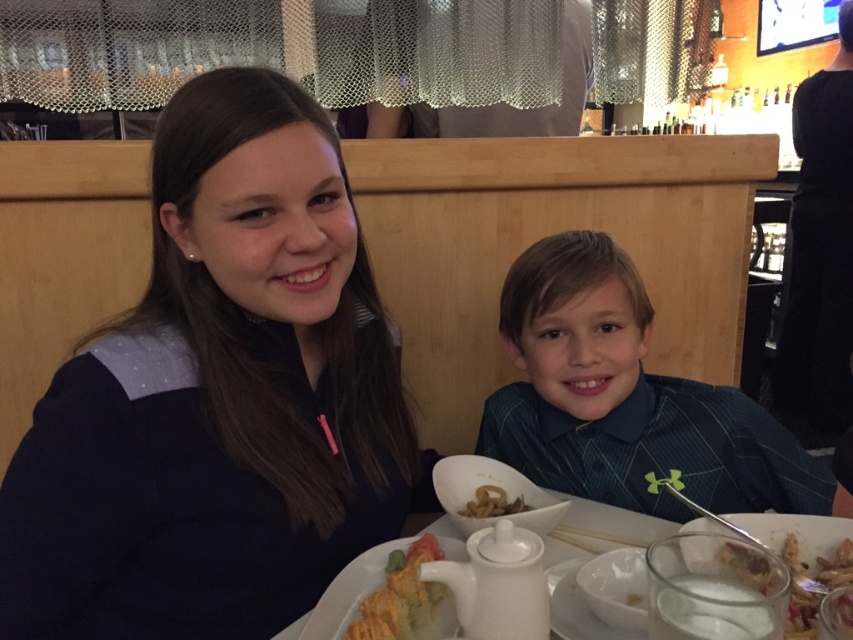
Can you confirm if blue striped shirt at center is bigger than white matte teapot at center?

Yes, blue striped shirt at center is bigger than white matte teapot at center.

Is blue striped shirt at center to the left of white matte teapot at center from the viewer's perspective?

No, blue striped shirt at center is not to the left of white matte teapot at center.

Is point (793, 504) positioned before point (381, 634)?

No, (793, 504) is behind (381, 634).

Find the location of a particular element. The image size is (853, 640). blue striped shirt at center is located at coordinates (625, 400).

Who is positioned more to the left, white creamy dessert at lower right or brown crispy onion at center?

brown crispy onion at center

Can you confirm if white creamy dessert at lower right is taller than brown crispy onion at center?

Yes.

Who is more forward, (728, 560) or (496, 499)?

Point (728, 560) is more forward.

Identify the location of white creamy dessert at lower right. The width and height of the screenshot is (853, 640). (811, 586).

Which is above, blue striped shirt at center or brown crispy onion at center?

Positioned higher is blue striped shirt at center.

Can you confirm if blue striped shirt at center is positioned below brown crispy onion at center?

Incorrect, blue striped shirt at center is not positioned below brown crispy onion at center.

Is point (560, 273) more distant than point (467, 513)?

Yes, it is.

Where is `blue striped shirt at center`? blue striped shirt at center is located at coordinates (625, 400).